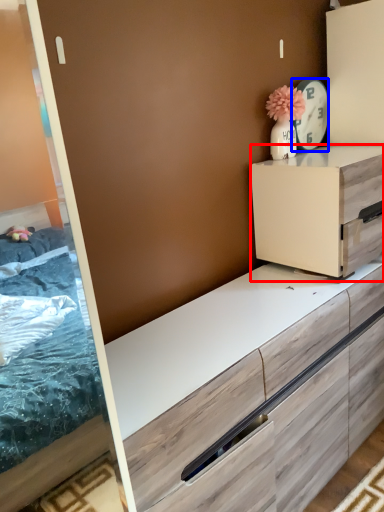
Question: Which object is closer to the camera taking this photo, chest of drawers (highlighted by a red box) or appliance (highlighted by a blue box)?

Choices:
 (A) chest of drawers
 (B) appliance

Answer: (A)